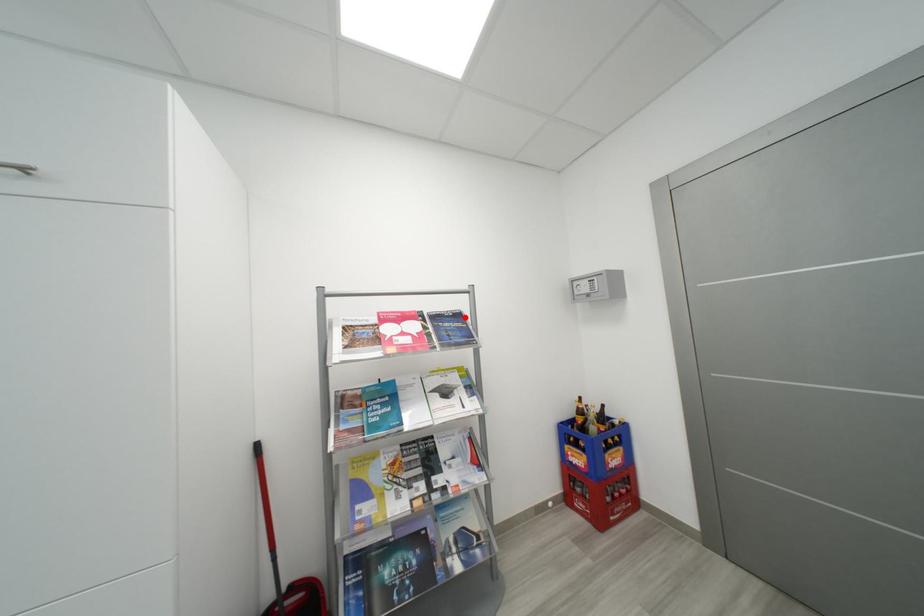
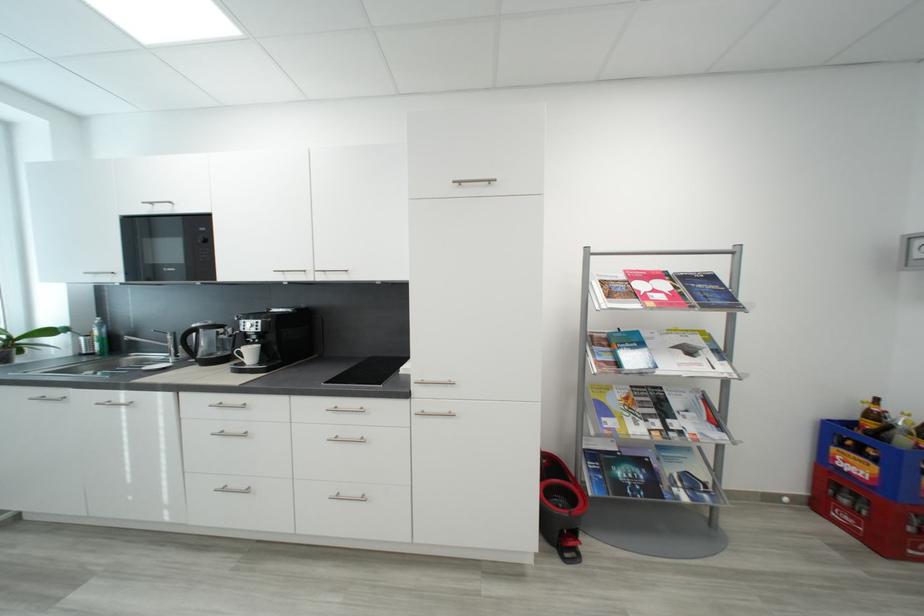
Locate, in the second image, the point that corresponds to the highlighted location in the first image.

(718, 280)